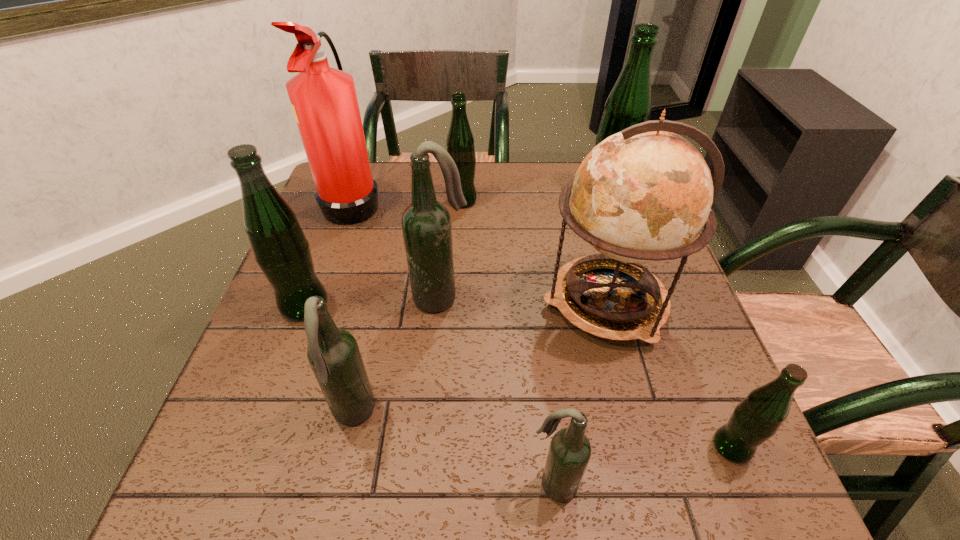
Select which green beer bottle is the closest to the leftmost beer bottle. Please provide its 2D coordinates. Your answer should be formatted as a tuple, i.e. [(x, y)], where the tuple contains the x and y coordinates of a point satisfying the conditions above.

[(460, 142)]

This screenshot has height=540, width=960. In order to click on the third closest dark beer bottle to the second green beer bottle from left to right in this screenshot , I will do `click(569, 453)`.

You are a GUI agent. You are given a task and a screenshot of the screen. Output one action in this format:
    pyautogui.click(x=<x>, y=<y>)
    Task: Click on the dark beer bottle that stands as the third closest to the smallest green beer bottle
    The height and width of the screenshot is (540, 960).
    Given the screenshot: What is the action you would take?
    pyautogui.click(x=333, y=354)

Find the location of a particular element. This screenshot has height=540, width=960. free spot that satisfies the following two spatial constraints: 1. on the back side of the tallest beer bottle; 2. at the spray nozzle of the fire extinguisher is located at coordinates (606, 201).

At what (x,y) coordinates should I click in order to perform the action: click on blank space that satisfies the following two spatial constraints: 1. on the back side of the smallest green beer bottle; 2. at the center of the globe. Please return your answer as a coordinate pair (x, y). This screenshot has width=960, height=540. Looking at the image, I should click on (673, 303).

This screenshot has height=540, width=960. Find the location of `vacant region that satisfies the following two spatial constraints: 1. at the spray nozzle of the fire extinguisher; 2. on the front side of the leftmost green beer bottle`. vacant region that satisfies the following two spatial constraints: 1. at the spray nozzle of the fire extinguisher; 2. on the front side of the leftmost green beer bottle is located at coordinates (318, 305).

This screenshot has height=540, width=960. Find the location of `vacant area in the image that satisfies the following two spatial constraints: 1. at the center of the globe; 2. on the front side of the leftmost beer bottle`. vacant area in the image that satisfies the following two spatial constraints: 1. at the center of the globe; 2. on the front side of the leftmost beer bottle is located at coordinates (607, 305).